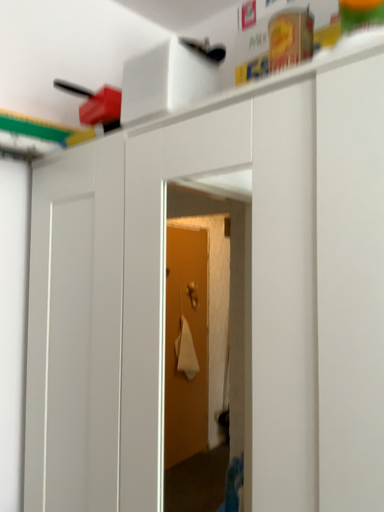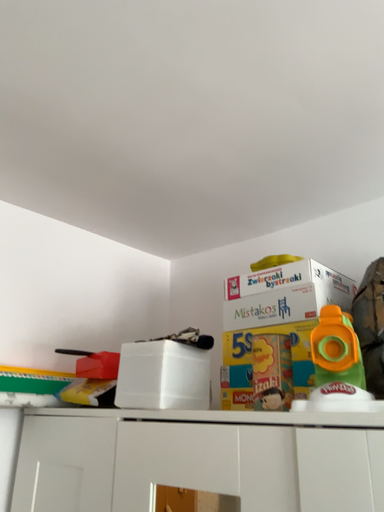
Question: Which way did the camera rotate in the video?

Choices:
 (A) rotated upward
 (B) rotated downward

Answer: (A)